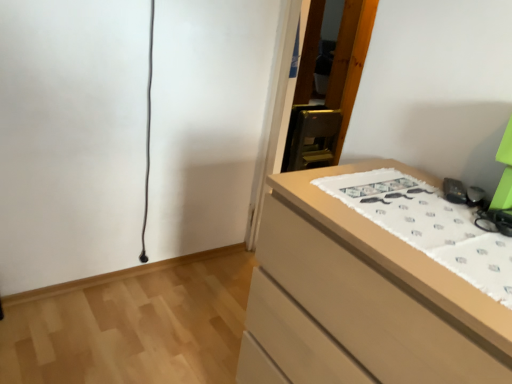
Question: Considering their positions, is matte wood chest of drawers at lower right located in front of or behind white fabric with printed mustaches at right?

Choices:
 (A) front
 (B) behind

Answer: (A)

Question: Visually, is matte wood chest of drawers at lower right positioned to the left or to the right of white fabric with printed mustaches at right?

Choices:
 (A) left
 (B) right

Answer: (A)

Question: Is matte wood chest of drawers at lower right wider or thinner than white fabric with printed mustaches at right?

Choices:
 (A) thin
 (B) wide

Answer: (B)

Question: Considering the positions of point (498, 241) and point (409, 246), is point (498, 241) closer or farther from the camera than point (409, 246)?

Choices:
 (A) closer
 (B) farther

Answer: (B)

Question: Looking at the image, does white fabric with printed mustaches at right seem bigger or smaller compared to matte wood chest of drawers at lower right?

Choices:
 (A) big
 (B) small

Answer: (B)

Question: Is white fabric with printed mustaches at right inside or outside of matte wood chest of drawers at lower right?

Choices:
 (A) inside
 (B) outside

Answer: (A)

Question: From a real-world perspective, is white fabric with printed mustaches at right physically located above or below matte wood chest of drawers at lower right?

Choices:
 (A) above
 (B) below

Answer: (A)